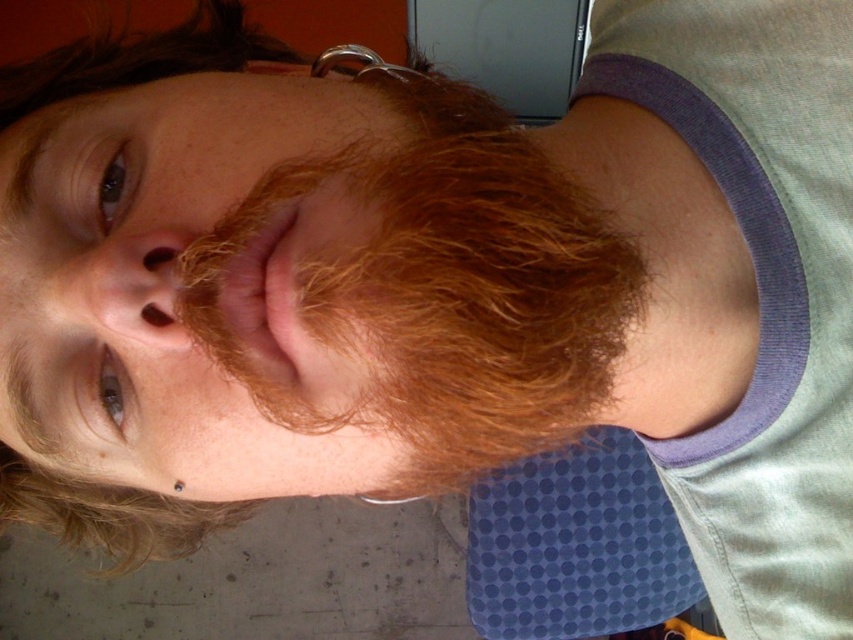
You are standing in front of the image and want to touch the point at coordinates point (561, 438) and point (824, 120). Which point is closer to you?

Point (561, 438) is in front of point (824, 120), so it is closer to you.